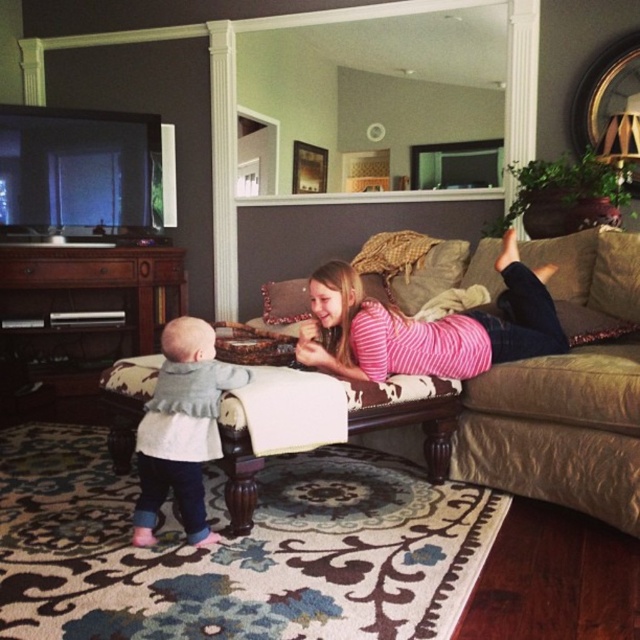
Does brown fabric couch at center appear on the right side of pink striped shirt at center?

Correct, you'll find brown fabric couch at center to the right of pink striped shirt at center.

Which of these two, brown fabric couch at center or pink striped shirt at center, stands shorter?

brown fabric couch at center

Image resolution: width=640 pixels, height=640 pixels. In order to click on brown fabric couch at center in this screenshot , I will do `click(554, 433)`.

Find the location of `brown fabric couch at center`. brown fabric couch at center is located at coordinates (554, 433).

Which is above, brown fabric couch at center or light gray knit sweater at center?

light gray knit sweater at center

Does point (531, 372) come behind point (248, 371)?

Yes, point (531, 372) is behind point (248, 371).

Between point (586, 470) and point (164, 396), which one is positioned behind?

The point (586, 470) is more distant.

Find the location of a particular element. Image resolution: width=640 pixels, height=640 pixels. brown fabric couch at center is located at coordinates (554, 433).

Can you confirm if pink striped shirt at center is bigger than light gray knit sweater at center?

Yes, pink striped shirt at center is bigger than light gray knit sweater at center.

Is pink striped shirt at center further to camera compared to light gray knit sweater at center?

That is True.

Which is in front, point (552, 314) or point (195, 372)?

Point (195, 372) is more forward.

This screenshot has height=640, width=640. I want to click on pink striped shirt at center, so click(x=429, y=326).